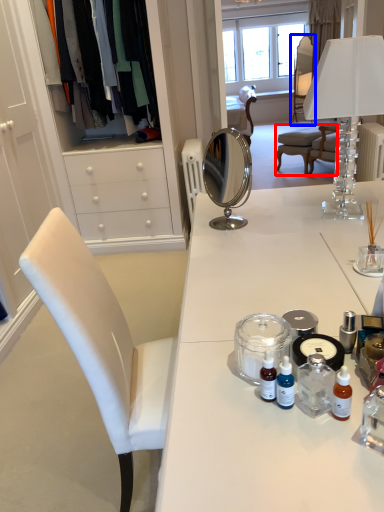
Question: Which object appears farthest to the camera in this image, chair (highlighted by a red box) or chair (highlighted by a blue box)?

Choices:
 (A) chair
 (B) chair

Answer: (B)